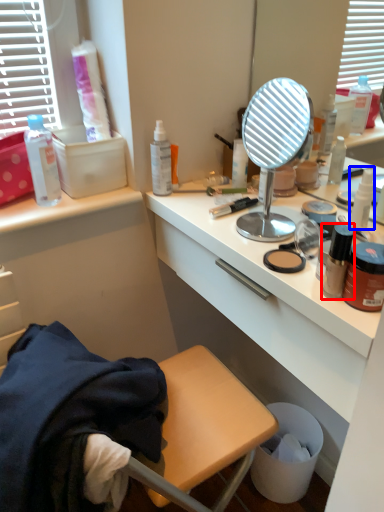
Question: Which of the following is the closest to the observer, bottle (highlighted by a red box) or bottle (highlighted by a blue box)?

Choices:
 (A) bottle
 (B) bottle

Answer: (A)